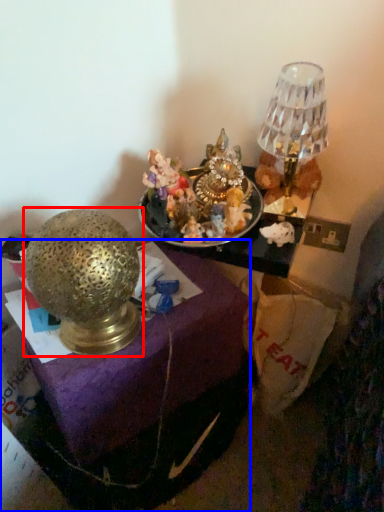
Question: Which point is further to the camera, lamp (highlighted by a red box) or furniture (highlighted by a blue box)?

Choices:
 (A) lamp
 (B) furniture

Answer: (B)